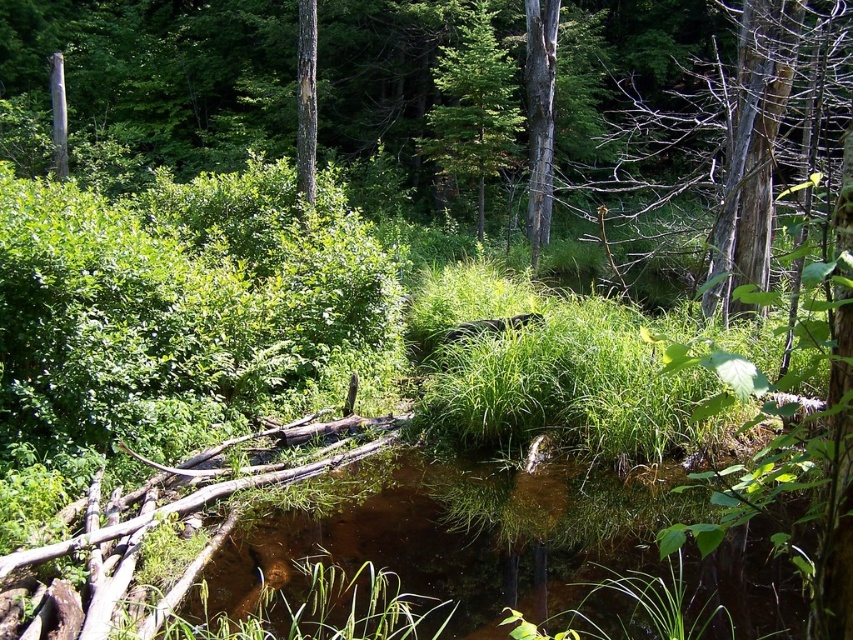
Question: Which of the following is the closest to the observer?

Choices:
 (A) (538, 6)
 (B) (508, 81)
 (C) (300, 17)
 (D) (469, 492)

Answer: (D)

Question: Among these points, which one is nearest to the camera?

Choices:
 (A) (310, 99)
 (B) (283, 564)
 (C) (543, 10)

Answer: (B)

Question: Is gray bark tree at center above smooth brown tree trunk at center?

Choices:
 (A) yes
 (B) no

Answer: (A)

Question: Is brown murky water at center to the right of smooth brown tree trunk at center from the viewer's perspective?

Choices:
 (A) yes
 (B) no

Answer: (A)

Question: Does gray bark tree at center have a smaller size compared to smooth brown tree trunk at center?

Choices:
 (A) no
 (B) yes

Answer: (A)

Question: Which object is farther from the camera taking this photo?

Choices:
 (A) smooth brown tree trunk at center
 (B) green matte tree at upper center
 (C) gray bark tree at center
 (D) brown murky water at center

Answer: (B)